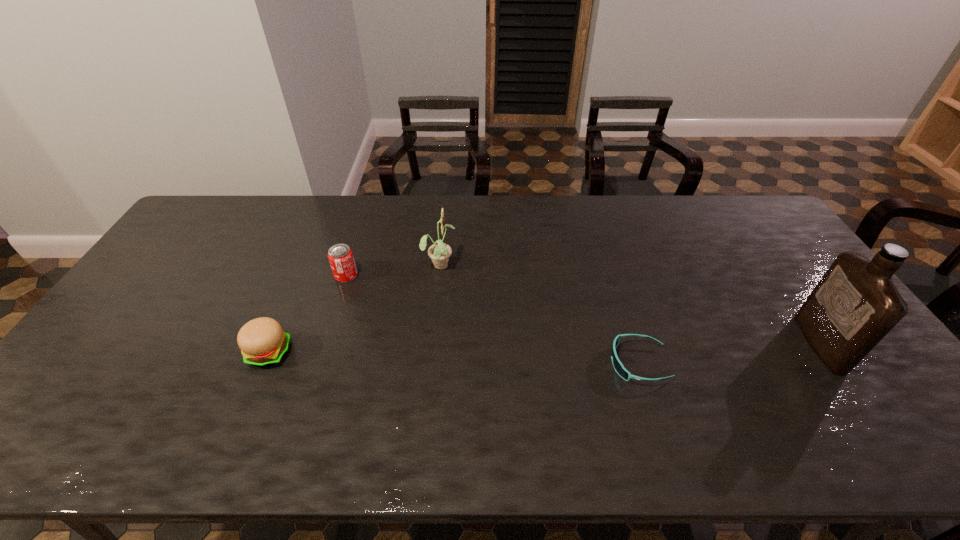
Identify the location of the rightmost object. Image resolution: width=960 pixels, height=540 pixels. (855, 305).

Where is `the tallest object`? the tallest object is located at coordinates (855, 305).

The width and height of the screenshot is (960, 540). What are the coordinates of `sunflower` in the screenshot? It's located at (439, 252).

The image size is (960, 540). I want to click on the fourth shortest object, so 439,252.

The width and height of the screenshot is (960, 540). Find the location of `the fourth object from right to left`. the fourth object from right to left is located at coordinates (340, 256).

Locate an element on the screen. the leftmost object is located at coordinates (262, 341).

Locate an element on the screen. This screenshot has height=540, width=960. the fourth object from left to right is located at coordinates (618, 366).

The image size is (960, 540). Identify the location of the shortest object. (618, 366).

At what (x,y) coordinates should I click in order to perform the action: click on vacant space located on the label side of the rightmost object. Please return your answer as a coordinate pair (x, y). The width and height of the screenshot is (960, 540). Looking at the image, I should click on (766, 343).

At what (x,y) coordinates should I click in order to perform the action: click on vacant space located on the label side of the rightmost object. Please return your answer as a coordinate pair (x, y). The image size is (960, 540). Looking at the image, I should click on (736, 343).